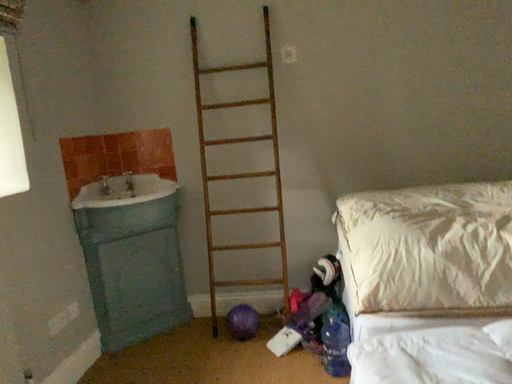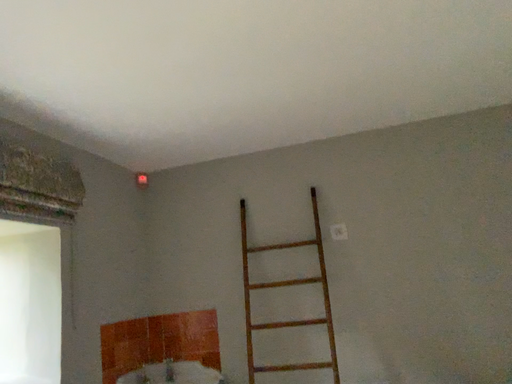
Question: Which way did the camera rotate in the video?

Choices:
 (A) rotated right
 (B) rotated left

Answer: (B)